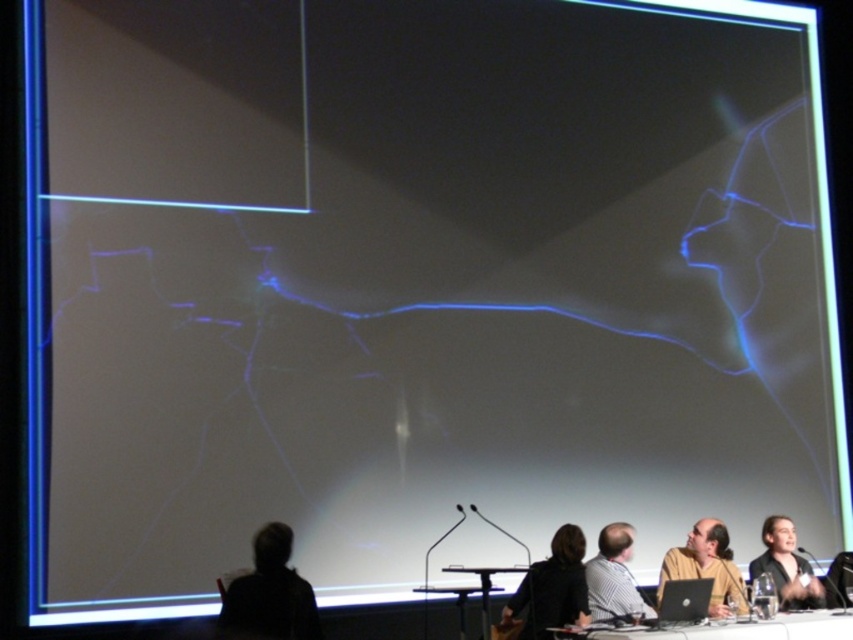
You are organizing a photo shoot and need to ensure that the two shirts in the image are at least 3 feet apart for proper lighting. Based on the scene description, can you confirm if the striped fabric shirt at lower center and the smooth black shirt at lower right meet this requirement?

The striped fabric shirt at lower center and smooth black shirt at lower right are 3.32 feet apart from each other, which is more than the required 3 feet. Therefore, they meet the requirement for proper lighting.

You are standing in front of the large screen during the presentation. There is a specific point at coordinates point (248, 588) that you need to focus on. If your eyes can focus clearly on objects as close as 4 meters away, will you be able to see the point clearly?

The distance of point (248, 588) from viewer is 4.32 meters, which is beyond your 4 meters minimum focus distance. Therefore, you can see the point clearly.